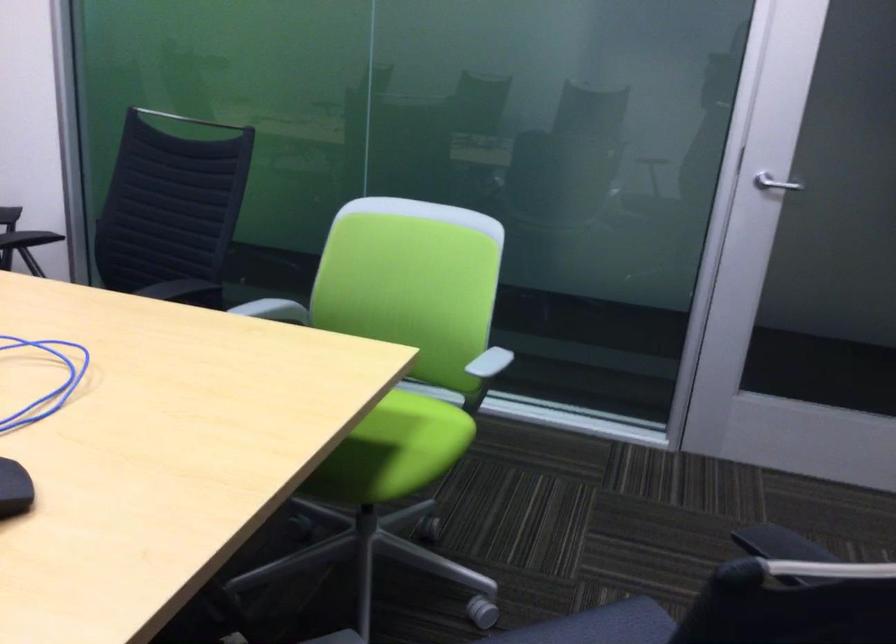
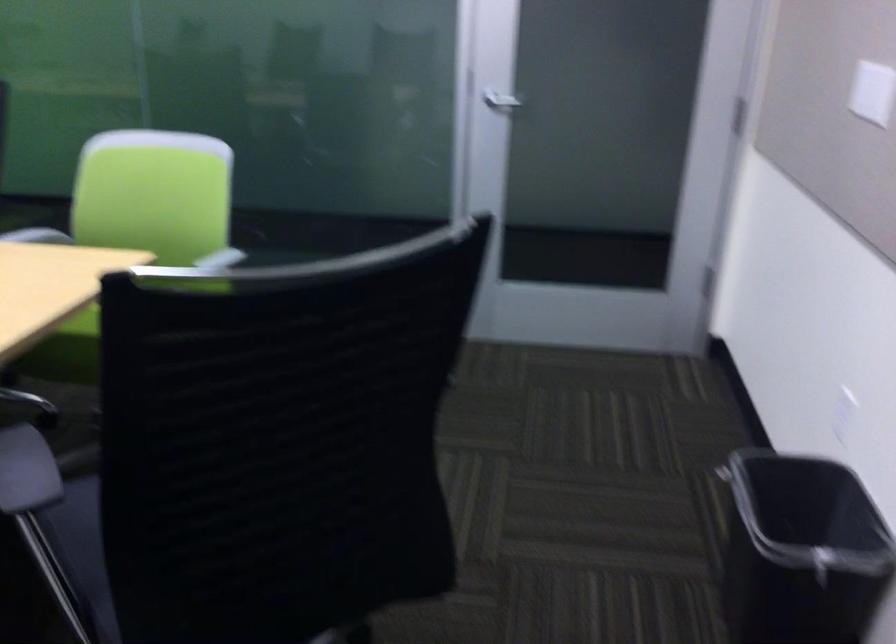
Question: The first image is from the beginning of the video and the second image is from the end. How did the camera likely rotate when shooting the video?

Choices:
 (A) Left
 (B) Right
 (C) Up
 (D) Down

Answer: (B)